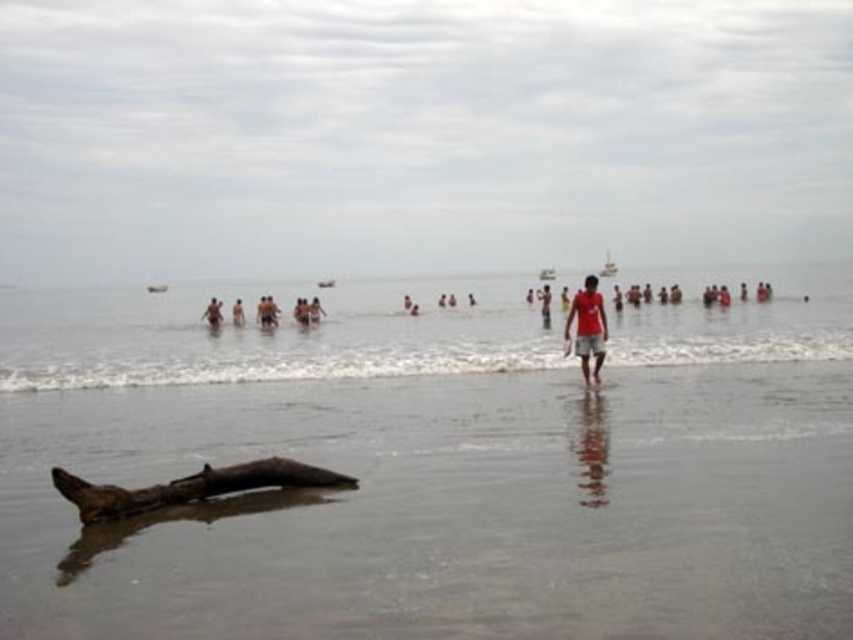
Is brown wood at center further to camera compared to brown wood log at lower center?

No, brown wood at center is closer to the viewer.

Does brown wood at center appear on the right side of brown wood log at lower center?

Correct, you'll find brown wood at center to the right of brown wood log at lower center.

What do you see at coordinates (437, 467) in the screenshot? The width and height of the screenshot is (853, 640). I see `brown wood at center` at bounding box center [437, 467].

Identify the location of brown wood at center. (437, 467).

Does brown wood at center appear under smooth skin person at center?

Yes, brown wood at center is below smooth skin person at center.

Can you confirm if brown wood at center is smaller than smooth skin person at center?

No, brown wood at center is not smaller than smooth skin person at center.

I want to click on brown wood at center, so click(437, 467).

Is matte red t-shirt at center positioned in front of smooth skin person at center?

Yes.

Image resolution: width=853 pixels, height=640 pixels. Find the location of `matte red t-shirt at center`. matte red t-shirt at center is located at coordinates (589, 326).